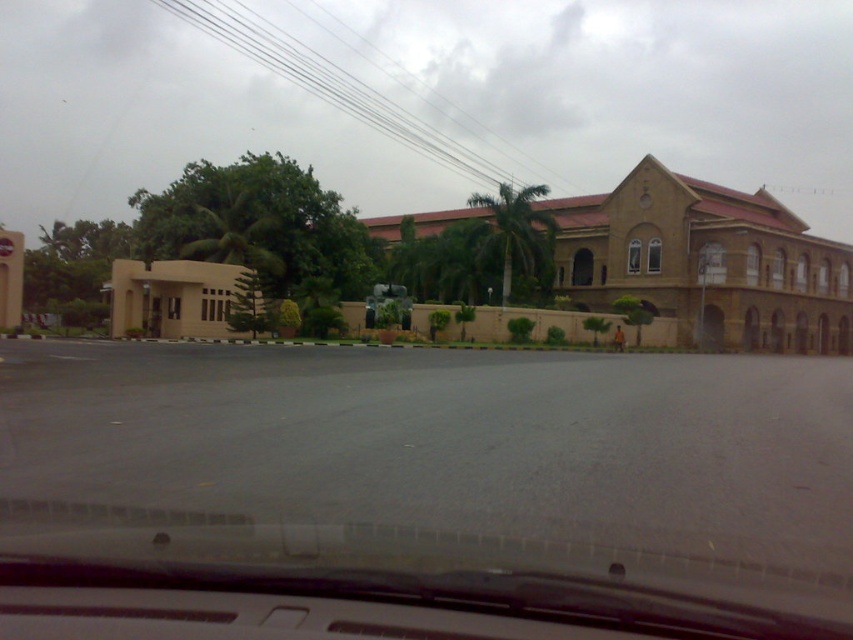
You are driving a car and approaching the beige matte building at left. You notice a transparent glass windshield at center in your path. Which object will you encounter first?

You will encounter the transparent glass windshield at center first because it is positioned below the beige matte building at left, meaning it is closer to your current position.

You are driving a car and approaching the beige matte building at left. You notice the transparent glass windshield at center in front of you. Which object is taller from your perspective?

The beige matte building at left is taller than the transparent glass windshield at center.

You are standing in front of the beige building with the red roof and want to take a photo. You notice two points marked in the scene. The first point is at coordinates point (396, 228) and the second point is at point (186, 328). Which point is closer to your camera position?

Point (396, 228) is further to the camera than point (186, 328), so the second point is closer to the camera.